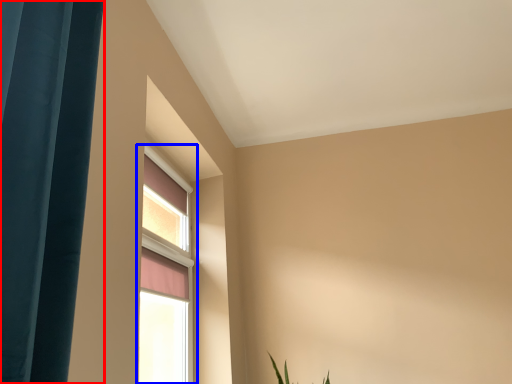
Question: Which object is closer to the camera taking this photo, curtain (highlighted by a red box) or window (highlighted by a blue box)?

Choices:
 (A) curtain
 (B) window

Answer: (A)